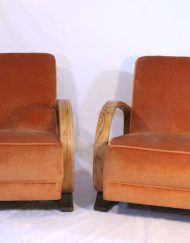
Find the location of a particular element. Image resolution: width=190 pixels, height=243 pixels. underside of chair barely visible is located at coordinates (135, 204), (27, 201).